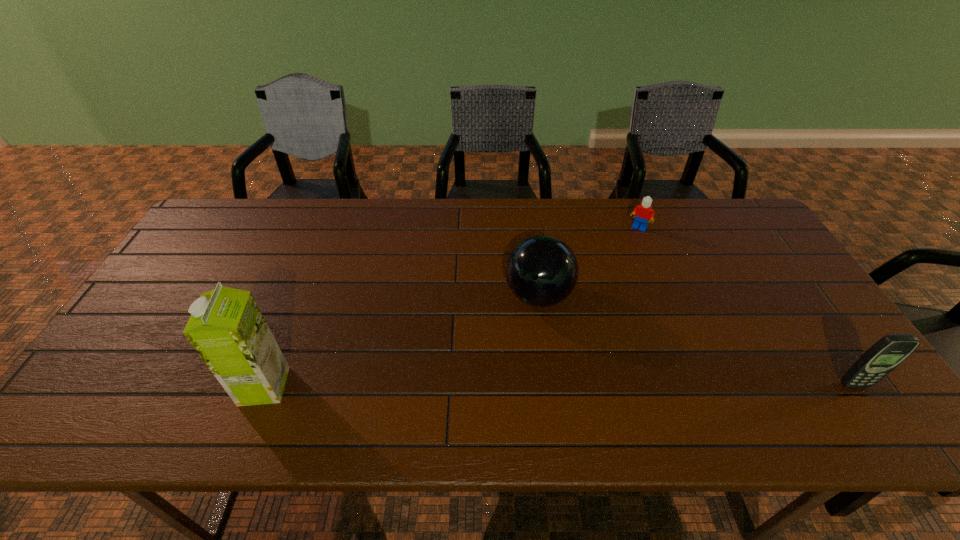
Where is `vacant space at the near edge of the desktop`? vacant space at the near edge of the desktop is located at coordinates (492, 365).

Locate an element on the screen. free space at the left edge of the desktop is located at coordinates (188, 247).

Where is `vacant space at the far left corner`? vacant space at the far left corner is located at coordinates (229, 239).

What are the coordinates of `vacant region at the far right corner of the desktop` in the screenshot? It's located at (732, 219).

In the image, there is a desktop. What are the coordinates of `free space at the near right corner` in the screenshot? It's located at (835, 393).

Where is `vacant space that's between the third object from right to left and the farthest object`? The image size is (960, 540). vacant space that's between the third object from right to left and the farthest object is located at coordinates (588, 261).

Where is `free spot between the rightmost object and the soya milk`? This screenshot has width=960, height=540. free spot between the rightmost object and the soya milk is located at coordinates (560, 386).

At what (x,y) coordinates should I click in order to perform the action: click on vacant space that is in between the second farthest object and the Lego. Please return your answer as a coordinate pair (x, y). This screenshot has width=960, height=540. Looking at the image, I should click on (588, 261).

Where is `unoccupied position between the second farthest object and the cellular telephone`? This screenshot has width=960, height=540. unoccupied position between the second farthest object and the cellular telephone is located at coordinates (696, 340).

At what (x,y) coordinates should I click in order to perform the action: click on vacant area that lies between the bowling ball and the rightmost object. Please return your answer as a coordinate pair (x, y). The width and height of the screenshot is (960, 540). Looking at the image, I should click on (696, 340).